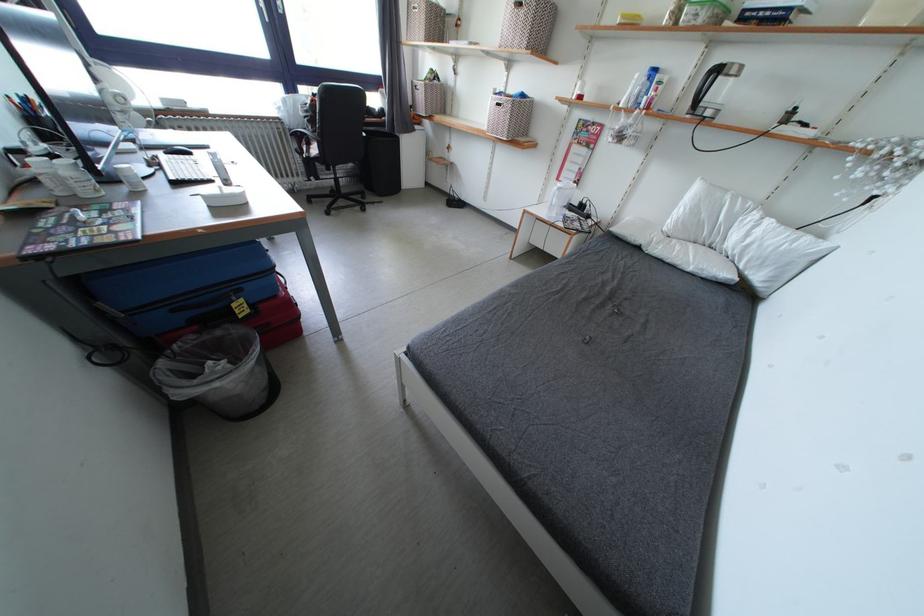
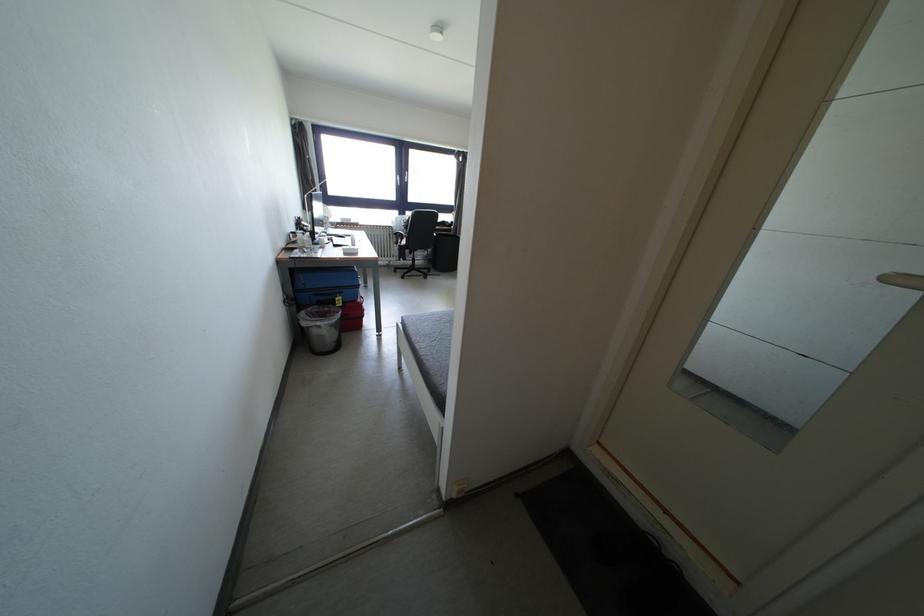
Locate, in the second image, the point that corresponds to (x=224, y=389) in the first image.

(324, 328)